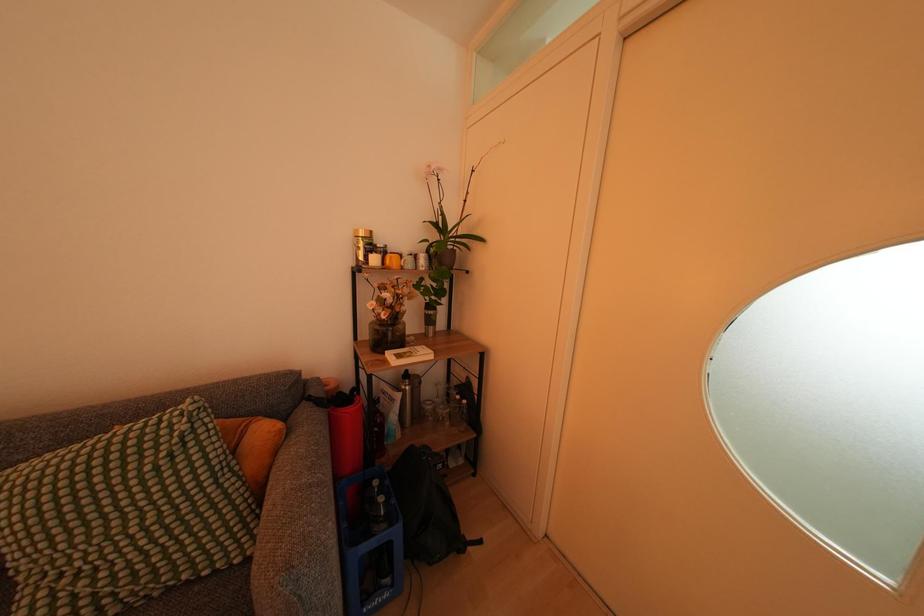
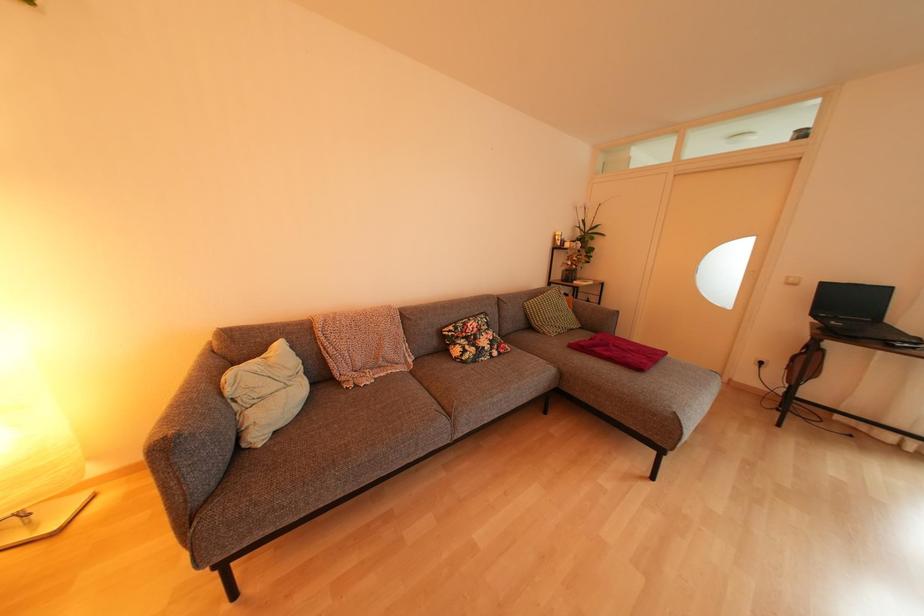
Which direction would the cameraman need to move to produce the second image?

The cameraman walked toward left, backward.